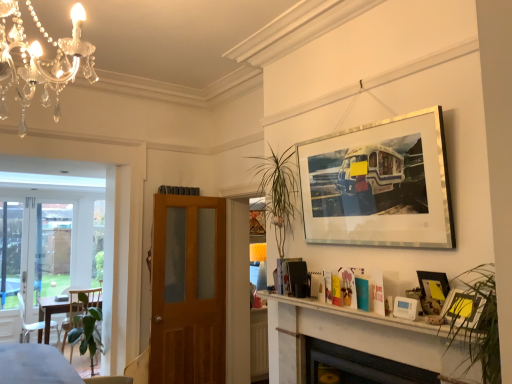
Question: Would you say wooden door at center is outside metallic silver picture frame at upper right, acting as the second picture frame starting from the bottom?

Choices:
 (A) yes
 (B) no

Answer: (A)

Question: Considering the relative sizes of wooden door at center and metallic silver picture frame at upper right, acting as the second picture frame starting from the bottom, in the image provided, is wooden door at center shorter than metallic silver picture frame at upper right, acting as the second picture frame starting from the bottom,?

Choices:
 (A) no
 (B) yes

Answer: (A)

Question: From the image's perspective, is wooden door at center beneath metallic silver picture frame at upper right, acting as the second picture frame starting from the bottom?

Choices:
 (A) no
 (B) yes

Answer: (B)

Question: Is wooden door at center far from metallic silver picture frame at upper right, acting as the second picture frame starting from the bottom?

Choices:
 (A) no
 (B) yes

Answer: (B)

Question: Can you confirm if wooden door at center is wider than metallic silver picture frame at upper right, positioned as the 3th picture frame in top-to-bottom order?

Choices:
 (A) yes
 (B) no

Answer: (A)

Question: Could metallic silver picture frame at upper right, positioned as the 3th picture frame in top-to-bottom order, be considered to be inside wooden door at center?

Choices:
 (A) no
 (B) yes

Answer: (A)

Question: From a real-world perspective, is wooden door at center on top of white plastic thermostat at lower right, which is the 1th picture frame from bottom to top?

Choices:
 (A) yes
 (B) no

Answer: (B)

Question: Is white plastic thermostat at lower right, which is the 1th picture frame from bottom to top, a part of wooden door at center?

Choices:
 (A) yes
 (B) no

Answer: (B)

Question: Does wooden door at center appear on the right side of white plastic thermostat at lower right, which is the 1th picture frame from bottom to top?

Choices:
 (A) yes
 (B) no

Answer: (B)

Question: Could you tell me if wooden door at center is facing white plastic thermostat at lower right, which is the 1th picture frame from bottom to top?

Choices:
 (A) yes
 (B) no

Answer: (A)

Question: Does wooden door at center come in front of white plastic thermostat at lower right, acting as the 4th picture frame starting from the top?

Choices:
 (A) no
 (B) yes

Answer: (A)

Question: From the image's perspective, is wooden door at center under white plastic thermostat at lower right, acting as the 4th picture frame starting from the top?

Choices:
 (A) yes
 (B) no

Answer: (A)

Question: Is silver/metallic picture frame at upper right, the 1th picture frame viewed from the top, next to green glossy plant at lower left?

Choices:
 (A) no
 (B) yes

Answer: (A)